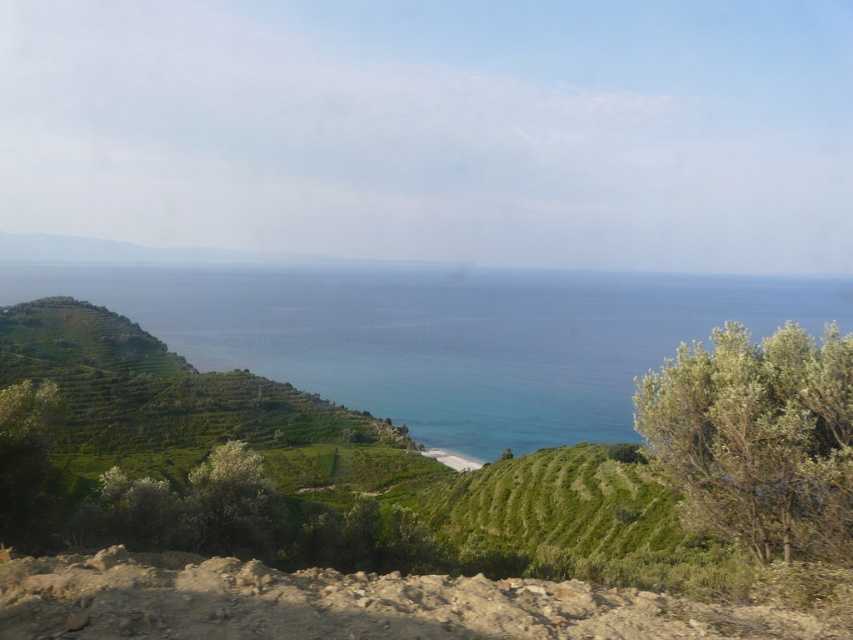
You are a hiker standing at the base of the hill, looking at the brown dirt at lower left and the green leafy bush at right. Which object is closer to the ground?

The brown dirt at lower left is closer to the ground since it has a lesser height compared to the green leafy bush at right.

You are a hiker who wants to cross from the brown dirt at lower left to the blue clear water at center. Given that your hiking boots have a grip suitable for rough terrain, can you safely walk across the rugged terrain between them?

The blue clear water at center has a larger size compared to brown dirt at lower left, but the rugged, uneven terrain with patches of greenery and exposed rocks between them may pose a challenge. However, since your hiking boots have grip for rough terrain, you can safely walk across the rugged terrain between the brown dirt at lower left and the blue clear water at center.

You are standing at the edge of the rugged terrain and want to walk towards the green leafy bush at right. Which direction should you move to first step on the brown dirt at lower left before reaching the bush?

First, move towards the brown dirt at lower left since it is closer to you than the green leafy bush at right. Once you step on the brown dirt at lower left, continue moving towards the green leafy bush at right.